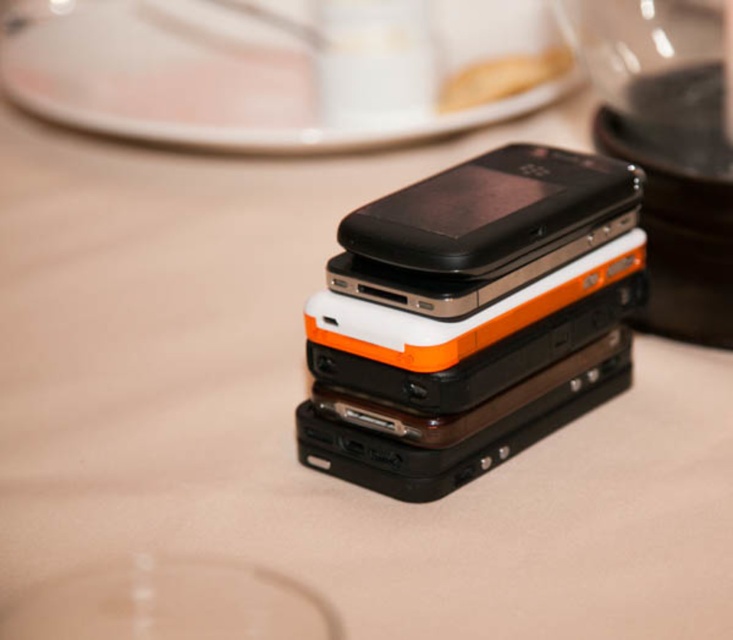
You are arranging items on a table and need to place the white glossy plate at upper center and the black matte smartphone at center. Based on their positions, which item is closer to you?

The white glossy plate at upper center is closer to you because it is further to the viewer than the black matte smartphone at center.

You are organizing items on a table and want to place the black plastic blender at upper right closer to the edge. However, there is a black matte smartphone at center in the way. Can you move the smartphone to make space without moving the blender?

The black plastic blender at upper right is positioned over the black matte smartphone at center, so moving the smartphone would allow the blender to be moved closer to the edge without obstruction.

You are setting up a small table for a meeting. You have a white glossy plate at upper center and a black matte smartphone at center. Which object should you place first if you want to ensure there is enough space for both on the table?

The white glossy plate at upper center might be wider than the black matte smartphone at center, so you should place the white glossy plate at upper center first to ensure there is enough space for both.